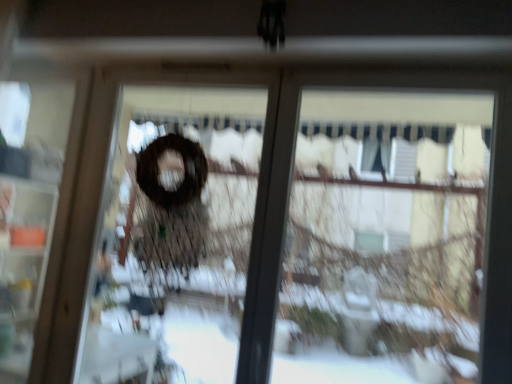
Question: Considering the relative positions of brown matte wreath at center, marked as the first screen door in a right-to-left arrangement, and transparent glass at center in the image provided, is brown matte wreath at center, marked as the first screen door in a right-to-left arrangement, to the left of transparent glass at center from the viewer's perspective?

Choices:
 (A) yes
 (B) no

Answer: (A)

Question: Is there a large distance between brown matte wreath at center, marked as the first screen door in a right-to-left arrangement, and transparent glass at center?

Choices:
 (A) no
 (B) yes

Answer: (B)

Question: Can you confirm if brown matte wreath at center, marked as the first screen door in a right-to-left arrangement, is shorter than transparent glass at center?

Choices:
 (A) no
 (B) yes

Answer: (A)

Question: Can you confirm if brown matte wreath at center, arranged as the 2th screen door when viewed from the left, is bigger than transparent glass at center?

Choices:
 (A) no
 (B) yes

Answer: (A)

Question: Does brown matte wreath at center, arranged as the 2th screen door when viewed from the left, turn towards transparent glass at center?

Choices:
 (A) no
 (B) yes

Answer: (A)

Question: Would you say brown matte wreath at center, marked as the first screen door in a right-to-left arrangement, is outside transparent glass at center?

Choices:
 (A) yes
 (B) no

Answer: (A)

Question: Would you say transparent plastic screen door at left, placed as the 1th screen door when sorted from left to right, is outside brown matte wreath at center, arranged as the 2th screen door when viewed from the left?

Choices:
 (A) yes
 (B) no

Answer: (A)

Question: Is the position of transparent plastic screen door at left, placed as the 1th screen door when sorted from left to right, more distant than that of brown matte wreath at center, arranged as the 2th screen door when viewed from the left?

Choices:
 (A) yes
 (B) no

Answer: (A)

Question: From a real-world perspective, is transparent plastic screen door at left, the 2th screen door from the right, below brown matte wreath at center, arranged as the 2th screen door when viewed from the left?

Choices:
 (A) yes
 (B) no

Answer: (A)

Question: Can you confirm if transparent plastic screen door at left, placed as the 1th screen door when sorted from left to right, is smaller than brown matte wreath at center, arranged as the 2th screen door when viewed from the left?

Choices:
 (A) no
 (B) yes

Answer: (A)

Question: Would you say transparent plastic screen door at left, placed as the 1th screen door when sorted from left to right, is a long distance from brown matte wreath at center, arranged as the 2th screen door when viewed from the left?

Choices:
 (A) yes
 (B) no

Answer: (A)

Question: Can you confirm if transparent plastic screen door at left, the 2th screen door from the right, is shorter than brown matte wreath at center, marked as the first screen door in a right-to-left arrangement?

Choices:
 (A) no
 (B) yes

Answer: (A)

Question: From a real-world perspective, is transparent plastic screen door at left, placed as the 1th screen door when sorted from left to right, on top of transparent glass at center?

Choices:
 (A) yes
 (B) no

Answer: (B)